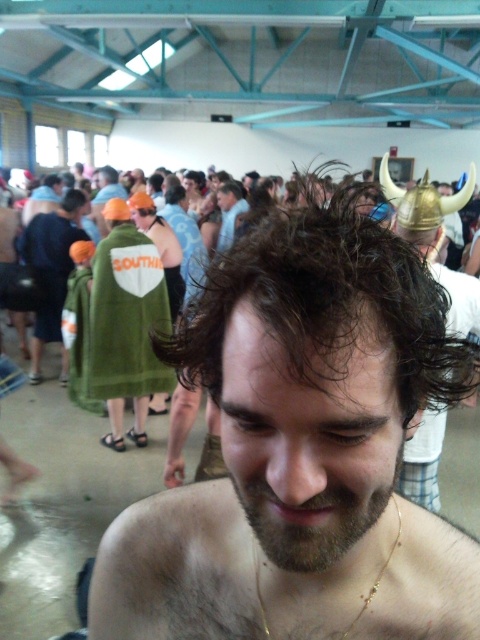
Which is more to the right, brown fuzzy beard at center or orange fabric cap at upper left?

From the viewer's perspective, brown fuzzy beard at center appears more on the right side.

Who is higher up, brown fuzzy beard at center or orange fabric cap at upper left?

Positioned higher is orange fabric cap at upper left.

Is point (330, 513) farther from camera compared to point (101, 216)?

No.

Find the location of a particular element. This screenshot has height=640, width=480. brown fuzzy beard at center is located at coordinates click(x=307, y=516).

Does brown curly hair at center have a lesser height compared to dark brown curly hair at center?

No.

Is point (343, 262) closer to camera compared to point (323, 346)?

No, (343, 262) is behind (323, 346).

Measure the distance between point [380,371] and camera.

Point [380,371] and camera are 12.58 inches apart.

Image resolution: width=480 pixels, height=640 pixels. What are the coordinates of `brown curly hair at center` in the screenshot? It's located at (301, 452).

Which of these two, orange fabric at left or orange foam helmet at upper left, stands shorter?

orange foam helmet at upper left

Does orange fabric at left have a larger size compared to orange foam helmet at upper left?

Correct, orange fabric at left is larger in size than orange foam helmet at upper left.

Is point (62, 211) positioned before point (69, 212)?

No, (62, 211) is behind (69, 212).

The image size is (480, 640). What are the coordinates of `orange fabric at left` in the screenshot? It's located at (50, 268).